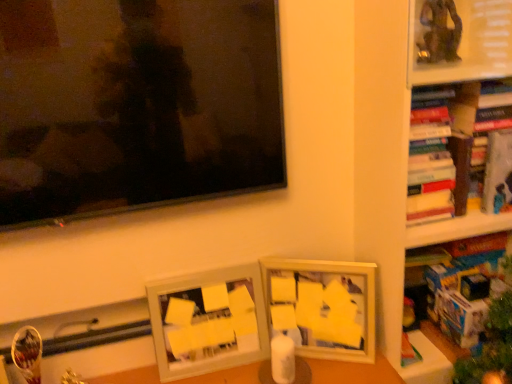
Question: In the image, is matte black television at upper left positioned in front of or behind matte white picture frame at center, arranged as the 1th picture frame when viewed from the right?

Choices:
 (A) front
 (B) behind

Answer: (A)

Question: Is matte black television at upper left spatially inside matte white picture frame at center, the 2th picture frame when ordered from left to right, or outside of it?

Choices:
 (A) outside
 (B) inside

Answer: (A)

Question: Which is nearer to the white matte picture frame at center, which is the 2th picture frame from right to left?

Choices:
 (A) hardcover book at upper right, the third book ordered from the bottom
 (B) matte black television at upper left
 (C) matte white picture frame at center, arranged as the 1th picture frame when viewed from the right
 (D) wooden bookshelf at right
 (E) blue cardboard book at right, acting as the 1th book starting from the bottom

Answer: (C)

Question: Which object is the closest to the hardcover book at upper right, the 2th book when ordered from top to bottom?

Choices:
 (A) wooden bookshelf at right
 (B) matte white picture frame at center, arranged as the 1th picture frame when viewed from the right
 (C) blue cardboard book at right, acting as the 1th book starting from the bottom
 (D) hardcover book at upper right, the first book positioned from the top
 (E) white matte picture frame at center, which is counted as the 1th picture frame, starting from the left

Answer: (D)